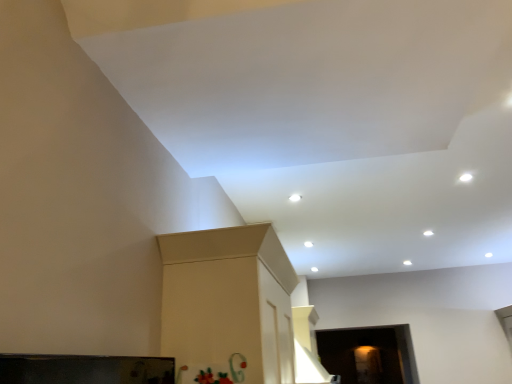
Describe the element at coordinates (228, 304) in the screenshot. The width and height of the screenshot is (512, 384). I see `matte beige cabinet at center` at that location.

Find the location of a particular element. matte beige cabinet at center is located at coordinates (228, 304).

Find the location of a particular element. Image resolution: width=512 pixels, height=384 pixels. matte beige cabinet at center is located at coordinates (228, 304).